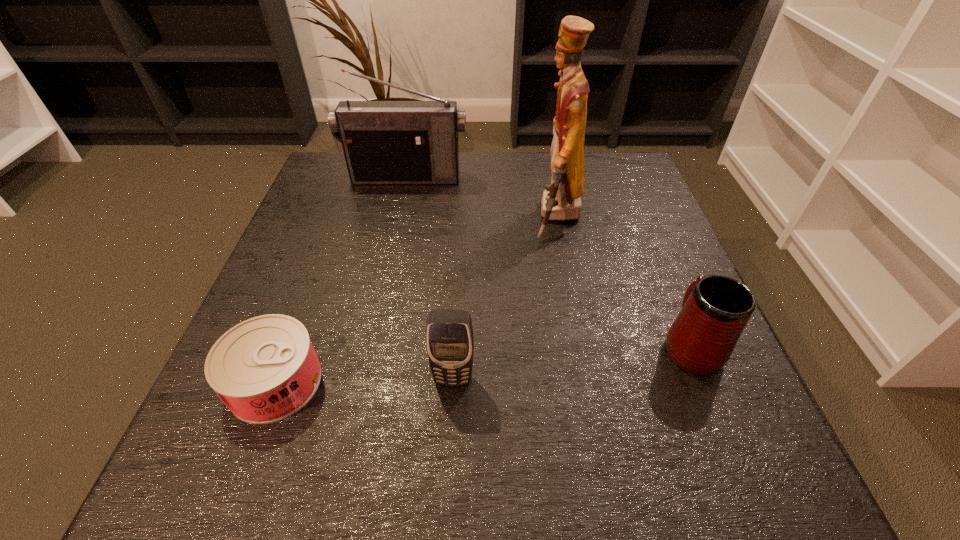
Identify the location of blank space that satisfies the following two spatial constraints: 1. on the side of the mug with the handle; 2. on the front-facing side of the tallest object. (637, 217).

Locate an element on the screen. vacant area in the image that satisfies the following two spatial constraints: 1. on the front-facing side of the fourth nearest object; 2. on the front face of the cellular telephone is located at coordinates (590, 380).

Where is `free space that satisfies the following two spatial constraints: 1. on the front-facing side of the fourth nearest object; 2. on the front face of the cellular telephone`? free space that satisfies the following two spatial constraints: 1. on the front-facing side of the fourth nearest object; 2. on the front face of the cellular telephone is located at coordinates (590, 380).

Image resolution: width=960 pixels, height=540 pixels. What are the coordinates of `free space that satisfies the following two spatial constraints: 1. on the front-facing side of the tallest object; 2. on the side of the mug with the handle` in the screenshot? It's located at (583, 344).